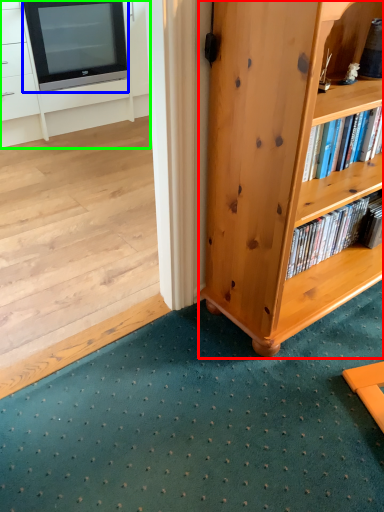
Question: Based on their relative distances, which object is nearer to bookcase (highlighted by a red box)? Choose from television (highlighted by a blue box) and cabinetry (highlighted by a green box).

Choices:
 (A) television
 (B) cabinetry

Answer: (B)